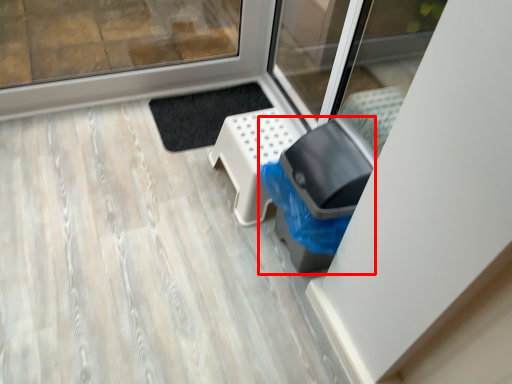
Question: Observing the image, what is the correct spatial positioning of garbage (annotated by the red box) in reference to furniture?

Choices:
 (A) left
 (B) right

Answer: (B)